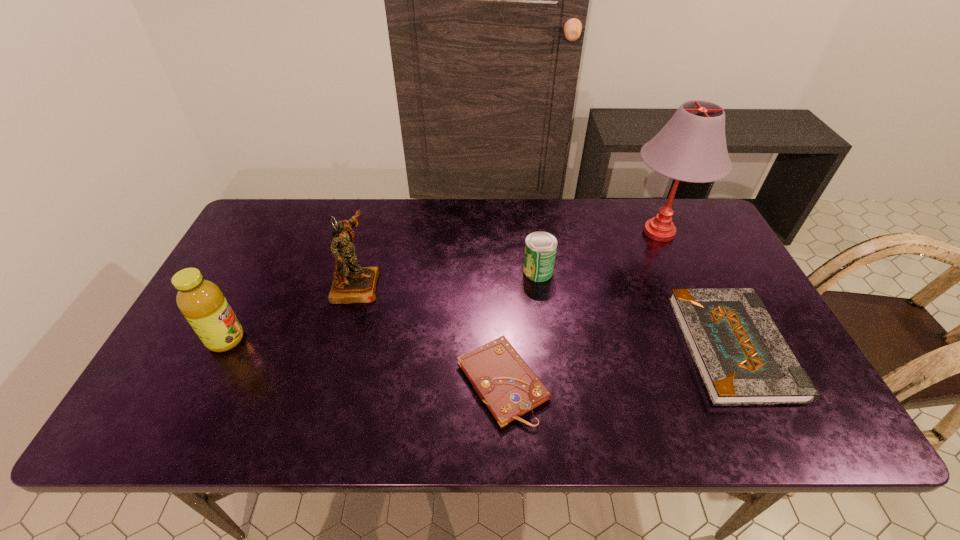
Locate an element on the screen. vacant area in the image that satisfies the following two spatial constraints: 1. on the front side of the can; 2. on the right side of the right notebook is located at coordinates (548, 347).

You are a GUI agent. You are given a task and a screenshot of the screen. Output one action in this format:
    pyautogui.click(x=<x>, y=<y>)
    Task: Click on the vacant region that satisfies the following two spatial constraints: 1. on the front-facing side of the farthest object; 2. on the front side of the can
    The width and height of the screenshot is (960, 540).
    Given the screenshot: What is the action you would take?
    pyautogui.click(x=676, y=271)

At what (x,y) coordinates should I click in order to perform the action: click on vacant space that satisfies the following two spatial constraints: 1. on the front-facing side of the figurine; 2. on the back side of the left notebook. Please return your answer as a coordinate pair (x, y). Image resolution: width=960 pixels, height=540 pixels. Looking at the image, I should click on pos(329,382).

Locate an element on the screen. The height and width of the screenshot is (540, 960). vacant region that satisfies the following two spatial constraints: 1. on the front label of the shorter notebook; 2. on the left side of the leftmost object is located at coordinates (205, 382).

Locate an element on the screen. vacant area that satisfies the following two spatial constraints: 1. on the front side of the taller notebook; 2. on the left side of the fourth tallest object is located at coordinates pyautogui.click(x=548, y=347).

Where is `vacant area in the image that satisfies the following two spatial constraints: 1. on the front label of the leftmost object; 2. on the back side of the taller notebook`? Image resolution: width=960 pixels, height=540 pixels. vacant area in the image that satisfies the following two spatial constraints: 1. on the front label of the leftmost object; 2. on the back side of the taller notebook is located at coordinates (223, 347).

I want to click on free spot that satisfies the following two spatial constraints: 1. on the front-facing side of the taller notebook; 2. on the right side of the farthest object, so coord(710,347).